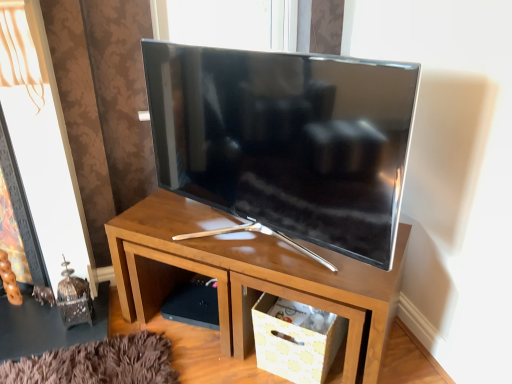
Locate an element on the screen. empty space that is in between wooden tv stand at center and white paper storage box at lower right is located at coordinates (196, 351).